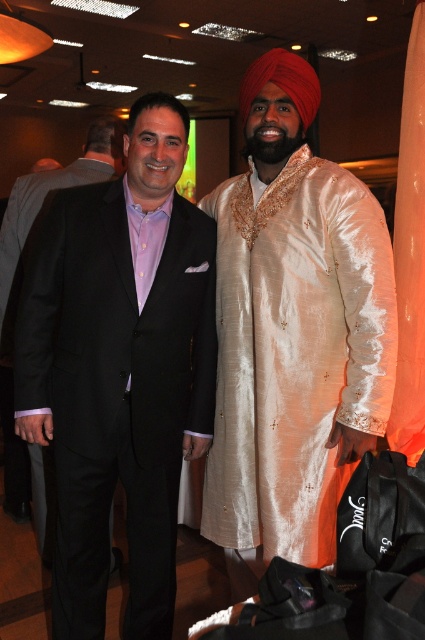
Question: Which object appears closest to the camera in this image?

Choices:
 (A) silky cream kurta at center
 (B) matte black suit at left
 (C) black satin suit at left

Answer: (C)

Question: Does black satin suit at left come in front of matte black suit at left?

Choices:
 (A) no
 (B) yes

Answer: (B)

Question: Can you confirm if silky cream kurta at center is wider than matte black suit at left?

Choices:
 (A) no
 (B) yes

Answer: (A)

Question: Does black satin suit at left have a smaller size compared to matte black suit at left?

Choices:
 (A) yes
 (B) no

Answer: (A)

Question: Which point is closer to the camera taking this photo?

Choices:
 (A) (42, 529)
 (B) (98, 323)

Answer: (B)

Question: Considering the real-world distances, which object is farthest from the black satin suit at left?

Choices:
 (A) silky cream kurta at center
 (B) matte black suit at left

Answer: (B)